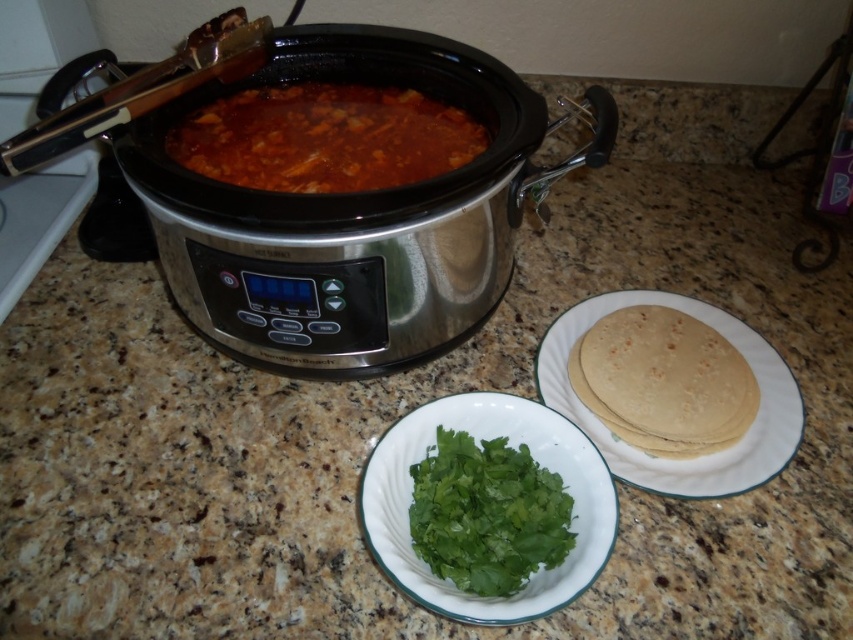
Question: Which object is farther from the camera taking this photo?

Choices:
 (A) green leafy at center
 (B) brown matte stew at center

Answer: (B)

Question: Is golden brown tortilla at right bigger than green leafy at center?

Choices:
 (A) yes
 (B) no

Answer: (A)

Question: Is green leafy herb at center further to the viewer compared to metallic silver tong at upper left?

Choices:
 (A) no
 (B) yes

Answer: (A)

Question: Which point appears farthest from the camera in this image?

Choices:
 (A) (305, 112)
 (B) (270, 284)

Answer: (A)

Question: Which object is positioned closest to the stainless steel slow cooker at center?

Choices:
 (A) green leafy at center
 (B) golden brown tortilla at right
 (C) green leafy herb at center

Answer: (C)

Question: Observing the image, what is the correct spatial positioning of green leafy at center in reference to metallic silver tong at upper left?

Choices:
 (A) above
 (B) below

Answer: (B)